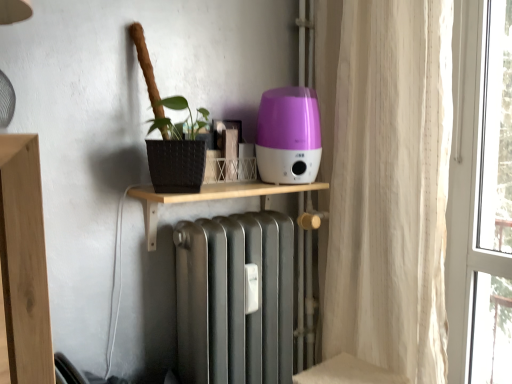
Question: Is purple glossy humidifier at center in front of or behind white sheer curtain at right in the image?

Choices:
 (A) behind
 (B) front

Answer: (A)

Question: Considering the positions of point (270, 177) and point (409, 370), is point (270, 177) closer or farther from the camera than point (409, 370)?

Choices:
 (A) farther
 (B) closer

Answer: (B)

Question: Which is nearer to the white sheer curtain at right?

Choices:
 (A) wooden shelf at center
 (B) purple glossy humidifier at center

Answer: (B)

Question: Considering the real-world distances, which object is farthest from the purple glossy humidifier at center?

Choices:
 (A) wooden shelf at center
 (B) white sheer curtain at right

Answer: (B)